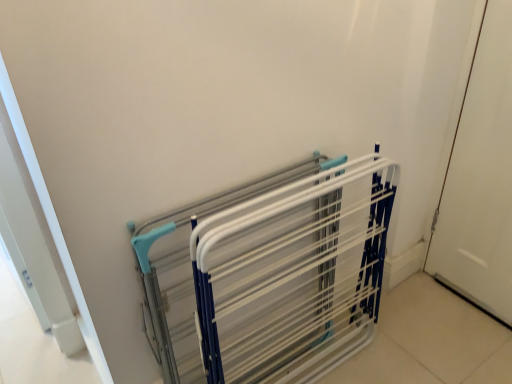
The height and width of the screenshot is (384, 512). What do you see at coordinates (480, 179) in the screenshot?
I see `white matte door at right` at bounding box center [480, 179].

Locate an element on the screen. white matte door at right is located at coordinates (480, 179).

Measure the distance between white matte door at right and camera.

white matte door at right is 1.21 meters from camera.

I want to click on white matte door at right, so point(480,179).